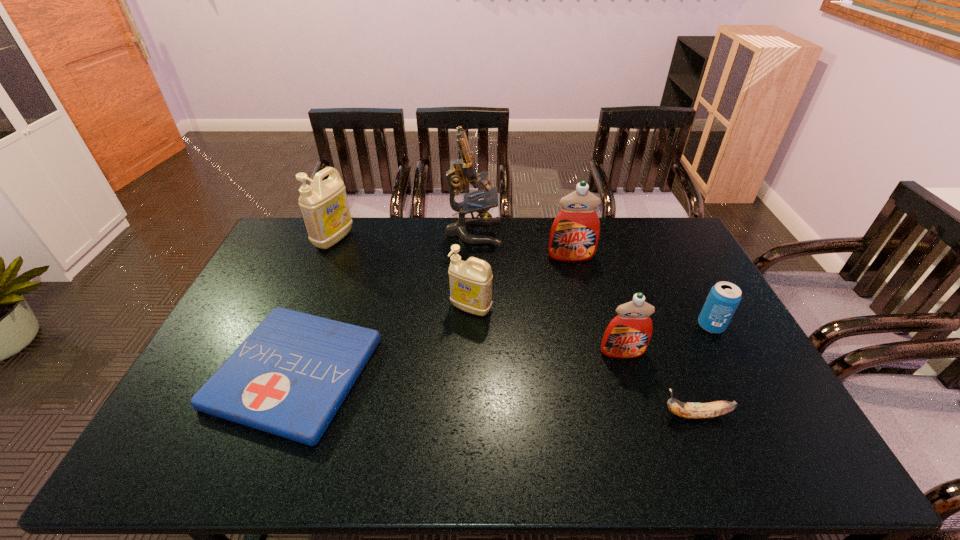
What are the coordinates of `vacant area in the image that satisfies the following two spatial constraints: 1. on the front side of the farther beige detergent; 2. on the left side of the right beige detergent` in the screenshot? It's located at (304, 308).